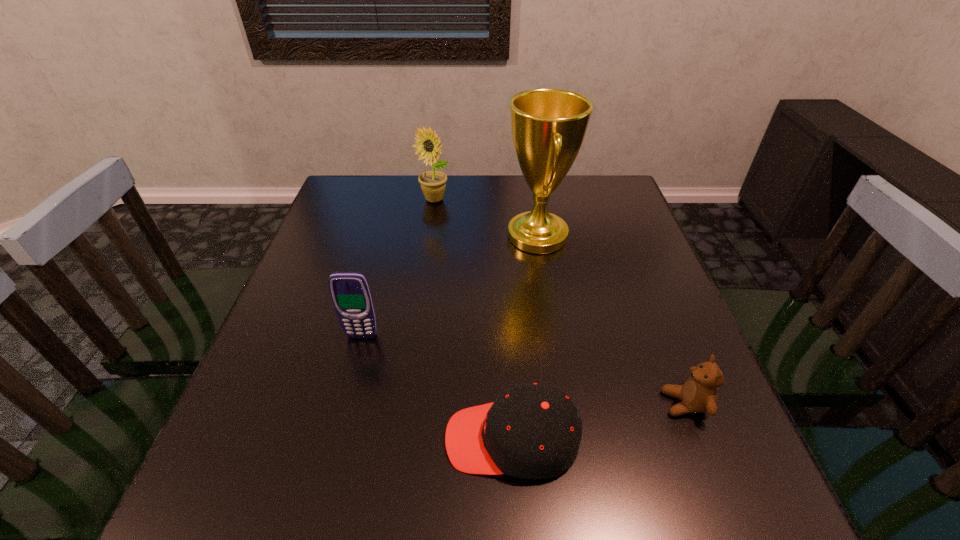
In order to click on the tallest object in this screenshot , I will do `click(548, 126)`.

Find the location of a particular element. This screenshot has width=960, height=540. sunflower is located at coordinates (433, 183).

I want to click on the fourth object from right to left, so pyautogui.click(x=433, y=183).

Where is `cellular telephone`? The height and width of the screenshot is (540, 960). cellular telephone is located at coordinates (350, 292).

Locate an element on the screen. Image resolution: width=960 pixels, height=540 pixels. the third farthest object is located at coordinates (350, 292).

This screenshot has height=540, width=960. What are the coordinates of `the rightmost object` in the screenshot? It's located at (698, 394).

Where is `cap`? Image resolution: width=960 pixels, height=540 pixels. cap is located at coordinates (531, 431).

Locate an element on the screen. The image size is (960, 540). vacant region located 0.360m by the handles of the award is located at coordinates (369, 236).

Where is `free space located 0.250m by the handles of the award`? Image resolution: width=960 pixels, height=540 pixels. free space located 0.250m by the handles of the award is located at coordinates (410, 236).

You are a GUI agent. You are given a task and a screenshot of the screen. Output one action in this format:
    pyautogui.click(x=<x>, y=<y>)
    Task: Click on the free space located 0.270m by the handles of the award
    The image size is (960, 540).
    Given the screenshot: What is the action you would take?
    pyautogui.click(x=402, y=236)